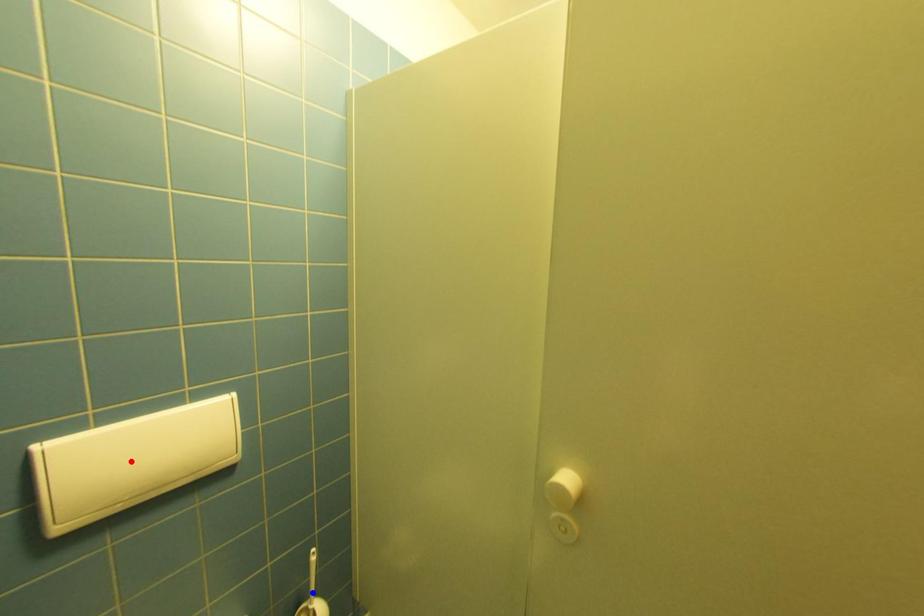
Question: Which of the two points in the image is closer to the camera?

Choices:
 (A) Blue point is closer.
 (B) Red point is closer.

Answer: (B)